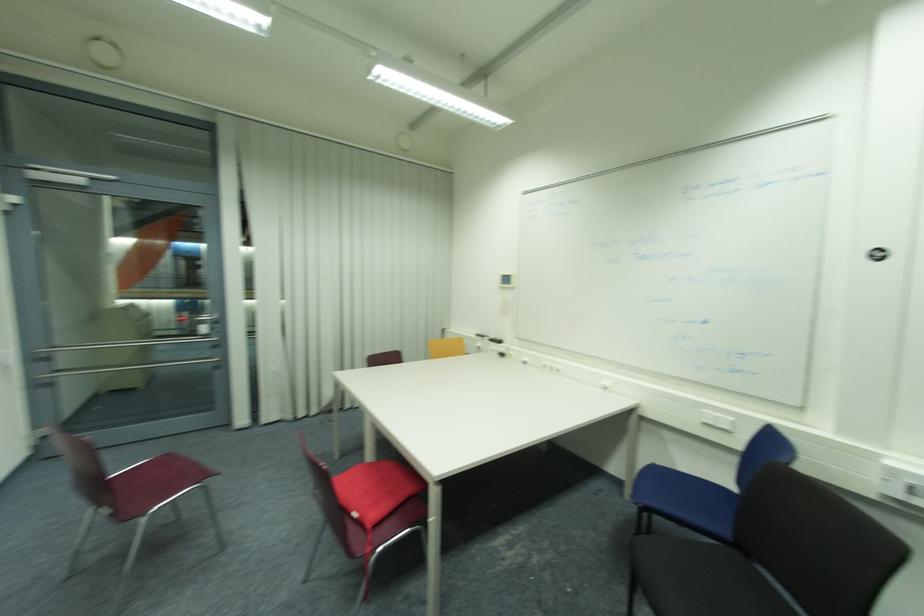
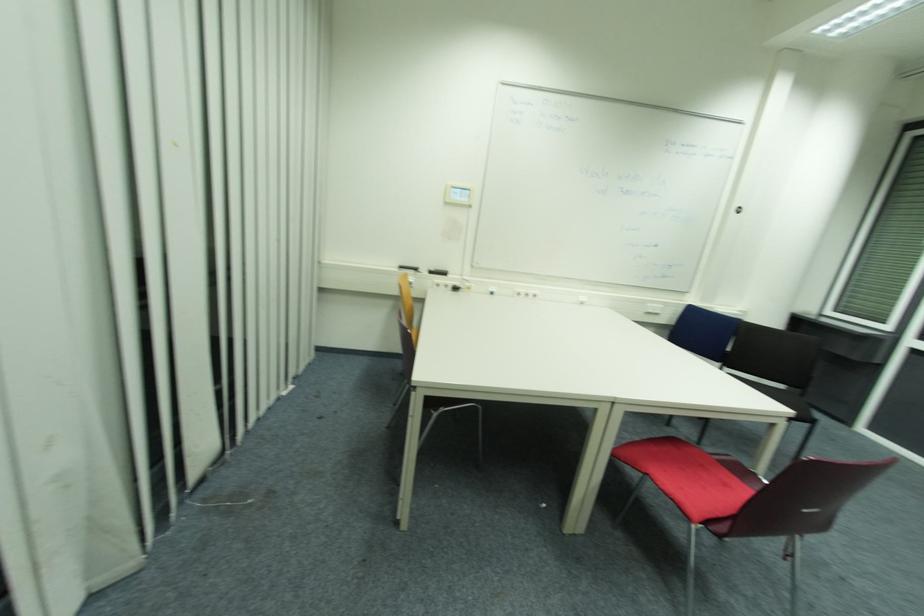
Find the pixel in the second image that matches (x=495, y=341) in the first image.

(433, 273)